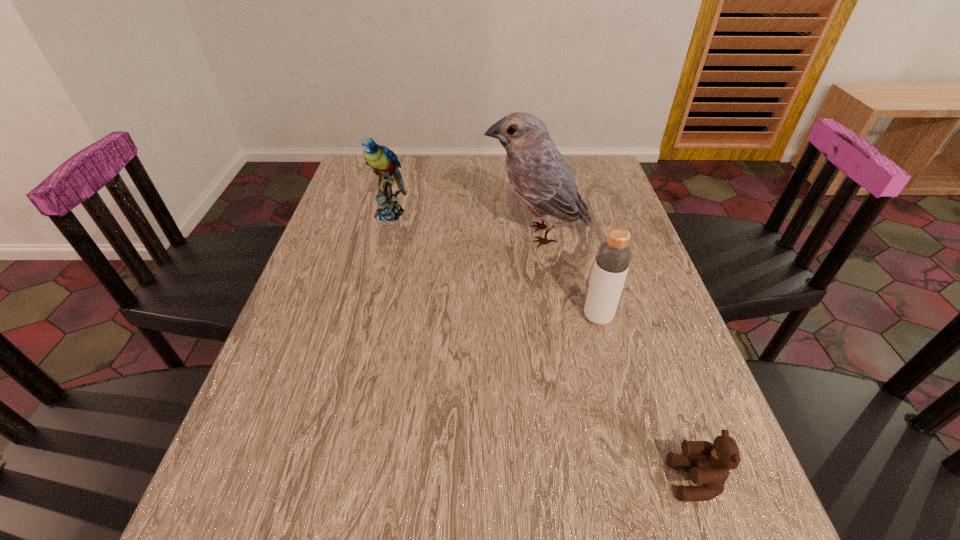
Identify the location of free region located on the face of the left parrot. The width and height of the screenshot is (960, 540). (365, 309).

You are a GUI agent. You are given a task and a screenshot of the screen. Output one action in this format:
    pyautogui.click(x=<x>, y=<y>)
    Task: Click on the free space located 0.400m on the left of the bottle
    
    Given the screenshot: What is the action you would take?
    pyautogui.click(x=404, y=317)

At what (x,y) coordinates should I click in order to perform the action: click on free space located 0.240m on the face of the rightmost object. Please return your answer as a coordinate pair (x, y). This screenshot has height=540, width=960. Looking at the image, I should click on (526, 480).

Locate an element on the screen. The height and width of the screenshot is (540, 960). vacant space situated 0.330m on the face of the rightmost object is located at coordinates (471, 480).

Locate an element on the screen. This screenshot has height=540, width=960. vacant position located on the face of the rightmost object is located at coordinates (592, 480).

Where is `object located at the left edge`? The width and height of the screenshot is (960, 540). object located at the left edge is located at coordinates (383, 161).

This screenshot has height=540, width=960. I want to click on parrot present at the right edge, so click(539, 175).

Where is `bottle that is at the right edge`? The image size is (960, 540). bottle that is at the right edge is located at coordinates (613, 257).

I want to click on teddy bear that is at the right edge, so click(711, 463).

Locate an element on the screen. Image resolution: width=960 pixels, height=540 pixels. free location at the far edge of the desktop is located at coordinates (435, 165).